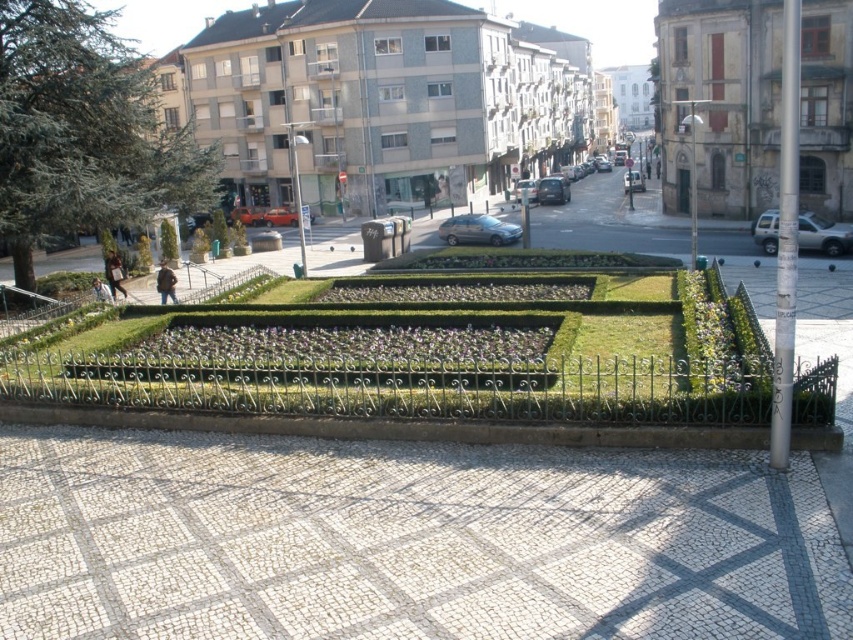
Question: Is white mosaic tiles at center below green leafy plant at center?

Choices:
 (A) yes
 (B) no

Answer: (A)

Question: Which of the following is the farthest from the observer?

Choices:
 (A) (747, 452)
 (B) (218, 358)

Answer: (B)

Question: Which point is farther from the camera taking this photo?

Choices:
 (A) (351, 536)
 (B) (80, 387)
 (C) (473, 340)

Answer: (C)

Question: Which object appears closest to the camera in this image?

Choices:
 (A) white mosaic tiles at center
 (B) green leafy plant at center

Answer: (A)

Question: Is white mosaic tiles at center positioned in front of green leafy plant at center?

Choices:
 (A) no
 (B) yes

Answer: (B)

Question: Is white mosaic tiles at center to the right of green leafy plant at center from the viewer's perspective?

Choices:
 (A) yes
 (B) no

Answer: (A)